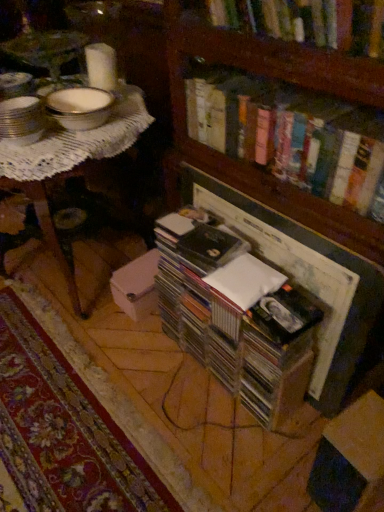
I want to click on free spot below white lace table at upper left (from a real-world perspective), so click(x=81, y=268).